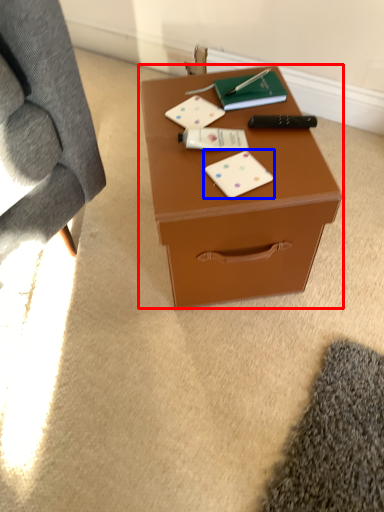
Question: Which point is further to the camera, table (highlighted by a red box) or card game (highlighted by a blue box)?

Choices:
 (A) table
 (B) card game

Answer: (B)